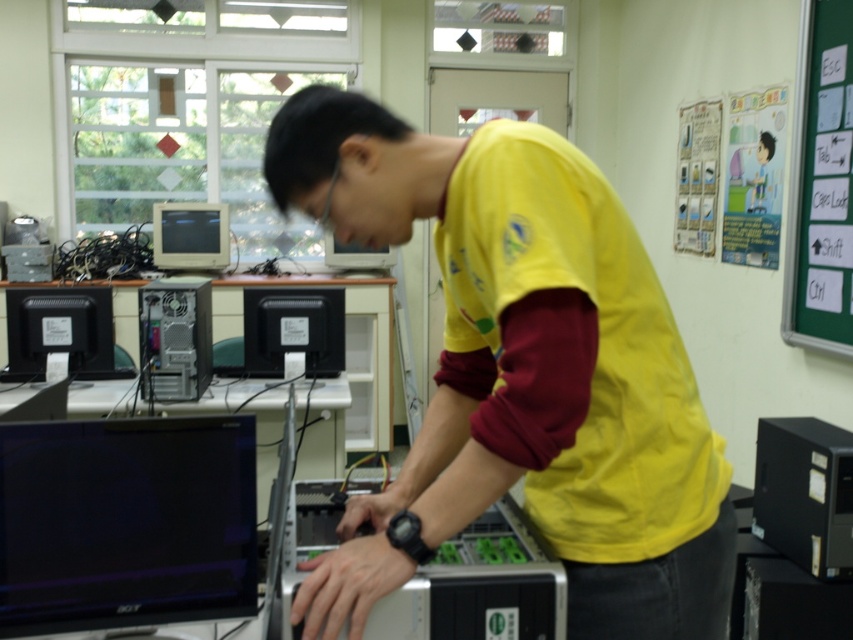
You are a technician trying to locate the green chalkboard at right and the black glossy monitor at left in the workspace. According to the scene, which object is placed higher?

The green chalkboard at right is positioned over the black glossy monitor at left, so it is higher.

You are a technician needing to move a 2.5 meter long cable from the green chalkboard at right to the black glossy monitor at left. Can the cable reach both devices without any extension?

The distance between the green chalkboard at right and the black glossy monitor at left is 2.74 meters. Since the cable is only 2.5 meters long, it is 0.24 meters shorter than needed. Therefore, the cable cannot reach both devices without an extension.

You are a technician who needs to reach the yellow fabric shirt at center to retrieve a tool. The black plastic monitor at center is in your way. Can you step around it without moving the monitor?

The distance between yellow fabric shirt at center and black plastic monitor at center is 6.20 feet, which is sufficient space to step around the monitor without needing to move it.